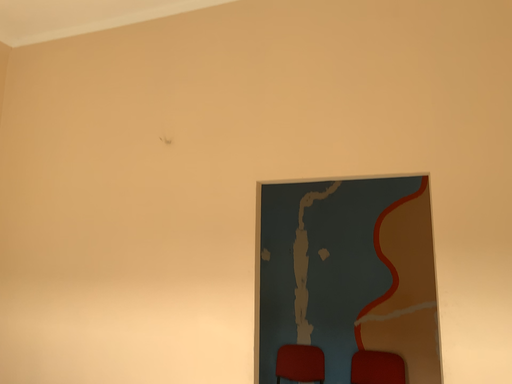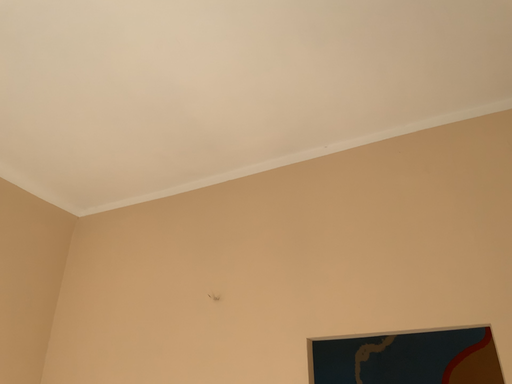
Question: Which way did the camera rotate in the video?

Choices:
 (A) rotated downward
 (B) rotated upward

Answer: (B)